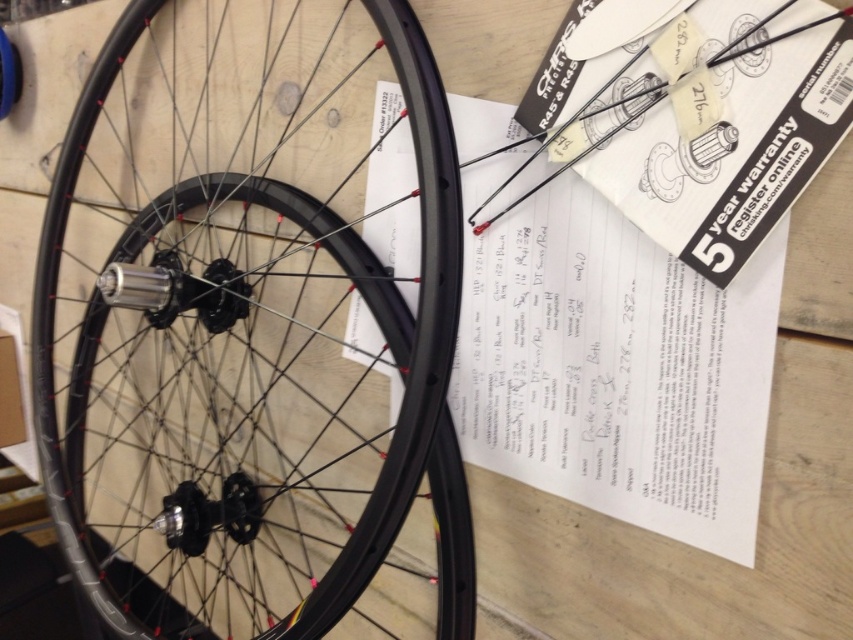
You are a delivery person checking the dimensions of the matte black rim at center and the white paper at center. Which object has a greater width?

The matte black rim at center has a greater width than the white paper at center.

You are a mechanic inspecting two points on a bicycle wheel. The points are labeled as point (299, 275) and point (380, 173). Which point is closer to you when looking at the wheel?

Point (299, 275) is further to the viewer than point (380, 173), so point (380, 173) is closer to you.